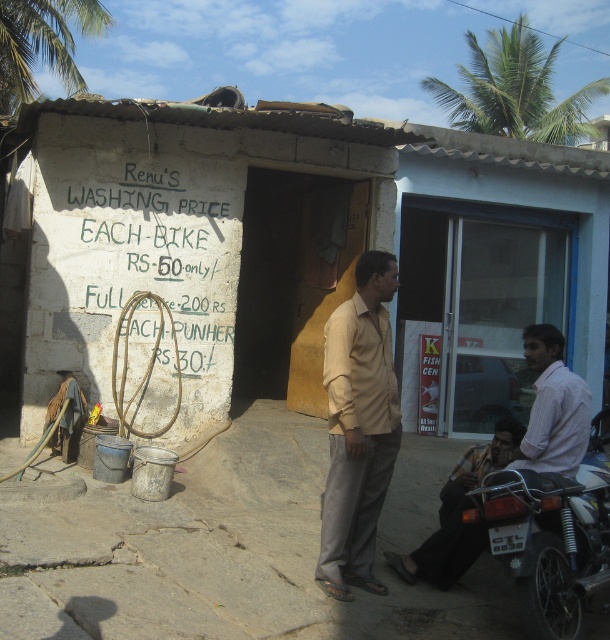
Which is in front, point (371, 545) or point (540, 99)?

Positioned in front is point (371, 545).

Does beige fabric shirt at center lie behind green leafy palm tree at upper center?

No, it is in front of green leafy palm tree at upper center.

I want to click on beige fabric shirt at center, so click(359, 428).

The height and width of the screenshot is (640, 610). What are the coordinates of `beige fabric shirt at center` in the screenshot? It's located at [x=359, y=428].

Does green chalk writing at center appear on the left side of green leafy palm tree at upper left?

In fact, green chalk writing at center is to the right of green leafy palm tree at upper left.

Who is more forward, (x=117, y=280) or (x=107, y=20)?

Point (x=117, y=280) is in front.

The width and height of the screenshot is (610, 640). What are the coordinates of `green chalk writing at center` in the screenshot? It's located at (162, 252).

Who is positioned more to the right, white concrete wall at center or light brown shirt at center?

From the viewer's perspective, light brown shirt at center appears more on the right side.

Which is more to the left, white concrete wall at center or light brown shirt at center?

Positioned to the left is white concrete wall at center.

Which is in front, point (389, 177) or point (529, 449)?

Point (529, 449)

Find the location of a particular element. This screenshot has height=640, width=610. white concrete wall at center is located at coordinates (289, 246).